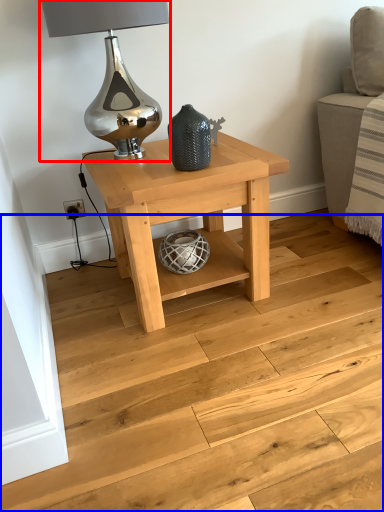
Question: Which of the following is the farthest to the observer, table lamp (highlighted by a red box) or stairwell (highlighted by a blue box)?

Choices:
 (A) table lamp
 (B) stairwell

Answer: (A)